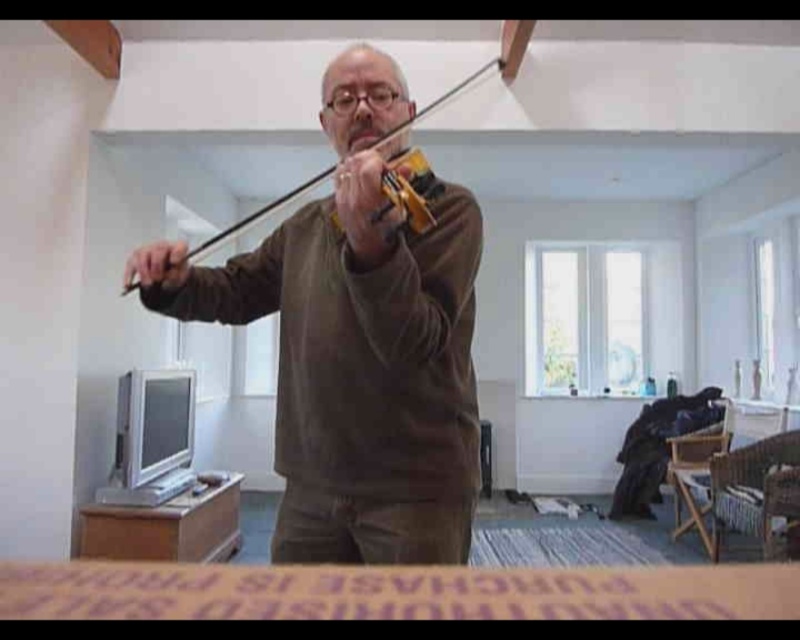
You are standing in the living room and want to place a small plant between the two points marked as point (x=424, y=307) and point (x=244, y=218). Which point should the plant be closer to so that it is closer to the violinist?

The plant should be closer to point (x=244, y=218) because point (x=424, y=307) is in front of point (x=244, y=218), meaning point (x=244, y=218) is behind and closer to the violinist.

You are a professional violinist who wants to play a piece that requires switching between two violins. You are standing in the living room and see the brown velvet violin at center and the wooden violin at center. Can you reach both violins without moving your feet?

The brown velvet violin at center and wooden violin at center are 4.54 meters apart from each other. Since the distance between them is greater than an average person can reach without moving, you cannot reach both violins without moving your feet.